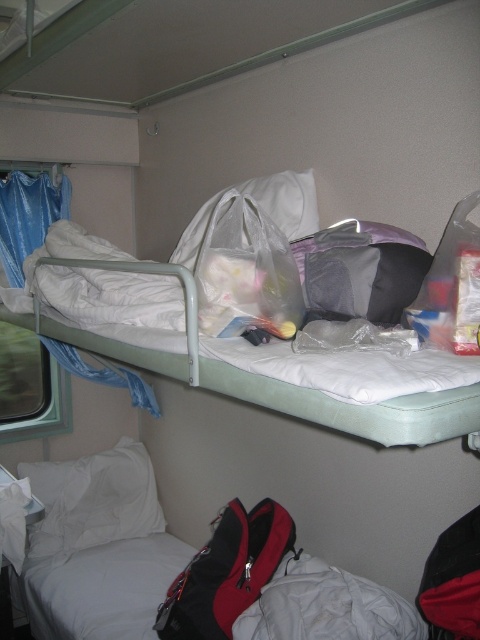
Is white fabric mattress at lower left below translucent plastic bag at upper center?

Correct, white fabric mattress at lower left is located below translucent plastic bag at upper center.

Can you confirm if white fabric mattress at lower left is taller than translucent plastic bag at upper center?

No, white fabric mattress at lower left is not taller than translucent plastic bag at upper center.

You are a GUI agent. You are given a task and a screenshot of the screen. Output one action in this format:
    pyautogui.click(x=<x>, y=<y>)
    Task: Click on the white fabric mattress at lower left
    The width and height of the screenshot is (480, 640).
    Given the screenshot: What is the action you would take?
    pyautogui.click(x=103, y=588)

The height and width of the screenshot is (640, 480). Identify the location of white fabric mattress at lower left. (103, 588).

Does white fabric bunk bed at upper center have a greater width compared to translucent plastic bag at upper center?

Indeed, white fabric bunk bed at upper center has a greater width compared to translucent plastic bag at upper center.

Who is positioned more to the left, white fabric bunk bed at upper center or translucent plastic bag at upper center?

From the viewer's perspective, white fabric bunk bed at upper center appears more on the left side.

Between point (169, 362) and point (275, 248), which one is positioned in front?

Point (275, 248) is more forward.

Identify the location of white fabric bunk bed at upper center. (286, 384).

Which is more to the right, red fabric backpack at lower center or white fabric pillow at upper center?

From the viewer's perspective, white fabric pillow at upper center appears more on the right side.

Does red fabric backpack at lower center appear on the left side of white fabric pillow at upper center?

Correct, you'll find red fabric backpack at lower center to the left of white fabric pillow at upper center.

Is point (223, 593) farther from camera compared to point (283, 228)?

Yes.

The image size is (480, 640). What are the coordinates of `red fabric backpack at lower center` in the screenshot? It's located at pyautogui.click(x=227, y=572).